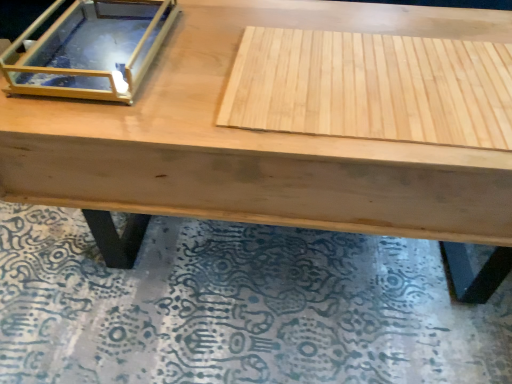
Find the location of a particular element. The image size is (512, 384). clear glass box at upper left is located at coordinates (91, 50).

This screenshot has height=384, width=512. What do you see at coordinates (237, 307) in the screenshot?
I see `wooden mat at lower center` at bounding box center [237, 307].

This screenshot has width=512, height=384. Identify the location of clear glass box at upper left. (91, 50).

From the image's perspective, which one is positioned higher, natural wood plywood at center or clear glass box at upper left?

clear glass box at upper left, from the image's perspective.

Find the location of `plywood located below the clear glass box at upper left (from the image's perspective)`. plywood located below the clear glass box at upper left (from the image's perspective) is located at coordinates (371, 87).

Is natural wood plywood at center facing away from clear glass box at upper left?

natural wood plywood at center is not turned away from clear glass box at upper left.

Is natural wood plywood at center positioned beyond the bounds of clear glass box at upper left?

Yes.

Is wooden mat at lower center situated inside natural wood plywood at center or outside?

wooden mat at lower center is not enclosed by natural wood plywood at center.

From the image's perspective, which one is positioned lower, wooden mat at lower center or natural wood plywood at center?

wooden mat at lower center, from the image's perspective.

From a real-world perspective, is wooden mat at lower center physically below natural wood plywood at center?

Indeed, from a real-world perspective, wooden mat at lower center is positioned beneath natural wood plywood at center.

In the image, is wooden mat at lower center positioned in front of or behind clear glass box at upper left?

A: wooden mat at lower center is positioned farther from the viewer than clear glass box at upper left.

From the image's perspective, is wooden mat at lower center located beneath clear glass box at upper left?

Yes, from the image's perspective, wooden mat at lower center is beneath clear glass box at upper left.

Is wooden mat at lower center aimed at clear glass box at upper left?

No, wooden mat at lower center is not facing towards clear glass box at upper left.

Considering the sizes of objects wooden mat at lower center and clear glass box at upper left in the image provided, who is thinner, wooden mat at lower center or clear glass box at upper left?

With smaller width is clear glass box at upper left.

Measure the distance from clear glass box at upper left to wooden mat at lower center.

They are 21.65 inches apart.

Is point (67, 44) closer or farther from the camera than point (145, 308)?

Point (67, 44) is positioned closer to the camera compared to point (145, 308).

Can you confirm if clear glass box at upper left is shorter than wooden mat at lower center?

No.

Between clear glass box at upper left and wooden mat at lower center, which one has smaller width?

clear glass box at upper left.

From the image's perspective, is clear glass box at upper left on natural wood plywood at center?

Yes, from the image's perspective, clear glass box at upper left is on top of natural wood plywood at center.

Are clear glass box at upper left and natural wood plywood at center far apart?

clear glass box at upper left is near natural wood plywood at center, not far away.

Can you tell me how much clear glass box at upper left and natural wood plywood at center differ in facing direction?

The angle between the facing direction of clear glass box at upper left and the facing direction of natural wood plywood at center is 0.00101 degrees.

From the picture: Is natural wood plywood at center at the left side of wooden mat at lower center?

No, natural wood plywood at center is not to the left of wooden mat at lower center.

Which object is more forward, natural wood plywood at center or wooden mat at lower center?

natural wood plywood at center.

From the image's perspective, is natural wood plywood at center under wooden mat at lower center?

Actually, natural wood plywood at center appears above wooden mat at lower center in the image.

Does natural wood plywood at center have a greater height compared to wooden mat at lower center?

Correct, natural wood plywood at center is much taller as wooden mat at lower center.

The height and width of the screenshot is (384, 512). I want to click on plywood beneath the clear glass box at upper left (from a real-world perspective), so click(371, 87).

Identify the location of mat to the left of natural wood plywood at center. This screenshot has width=512, height=384. (237, 307).

Which object lies nearer to the anchor point wooden mat at lower center, natural wood plywood at center or clear glass box at upper left?

Among the two, natural wood plywood at center is located nearer to wooden mat at lower center.

Based on their spatial positions, is clear glass box at upper left or natural wood plywood at center closer to wooden mat at lower center?

natural wood plywood at center is positioned closer to the anchor wooden mat at lower center.

Based on their spatial positions, is natural wood plywood at center or wooden mat at lower center further from clear glass box at upper left?

The object further to clear glass box at upper left is wooden mat at lower center.

From the image, which object appears to be nearer to clear glass box at upper left, wooden mat at lower center or natural wood plywood at center?

natural wood plywood at center.

Considering their positions, is clear glass box at upper left positioned further to natural wood plywood at center than wooden mat at lower center?

wooden mat at lower center.

Which object lies further to the anchor point natural wood plywood at center, wooden mat at lower center or clear glass box at upper left?

wooden mat at lower center.

Where is `plywood between clear glass box at upper left and wooden mat at lower center vertically`? plywood between clear glass box at upper left and wooden mat at lower center vertically is located at coordinates (371, 87).